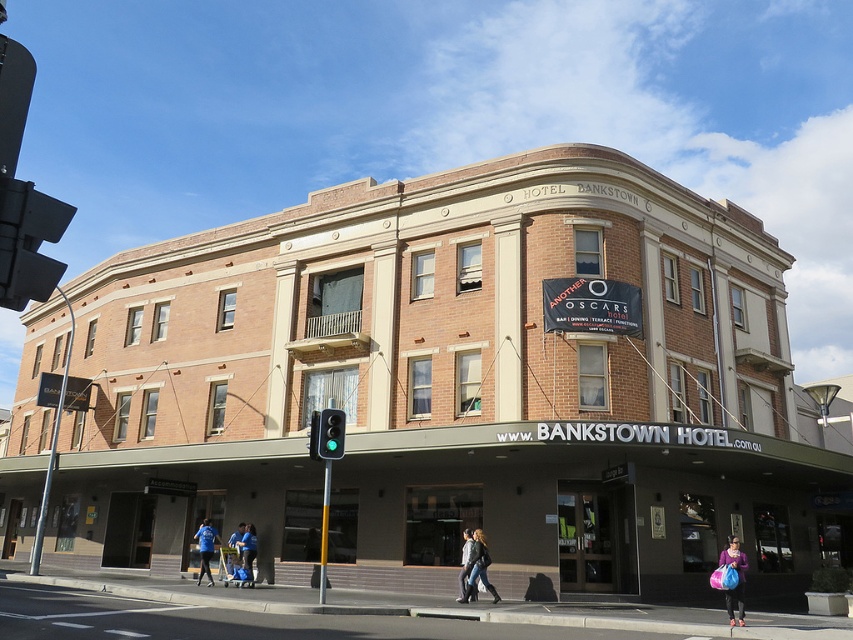
You are a hotel guest who just arrived and is standing near the entrance. You see a purple fabric bag at lower right and a denim jacket at lower center. Which item is covering the other?

The purple fabric bag at lower right is positioned over denim jacket at lower center, so the purple fabric bag is covering the denim jacket.

You are standing in front of the Hotel Bankstown and holding a purple fabric bag at lower right. You want to place it on a nearby bench that is 10 meters away. Can you reach the bench without moving closer to the building?

The purple fabric bag at lower right is 11.36 meters from the viewer. Since the bench is only 10 meters away, the bag is farther than the bench. Therefore, you cannot reach the bench without moving closer to the building.

You are a delivery person trying to fit a package into a box that can only accommodate items up to the width of the leather jacket at center. You have a package that is as wide as the denim jacket at lower center. Will the package fit in the box?

The denim jacket at lower center is wider than the leather jacket at center. Since the box can only hold items up to the width of the leather jacket at center, the package, which is as wide as the denim jacket at lower center, will not fit in the box.